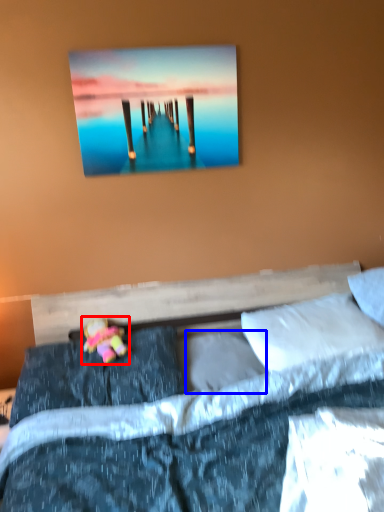
Question: Among these objects, which one is nearest to the camera, doll (highlighted by a red box) or pillow (highlighted by a blue box)?

Choices:
 (A) doll
 (B) pillow

Answer: (A)